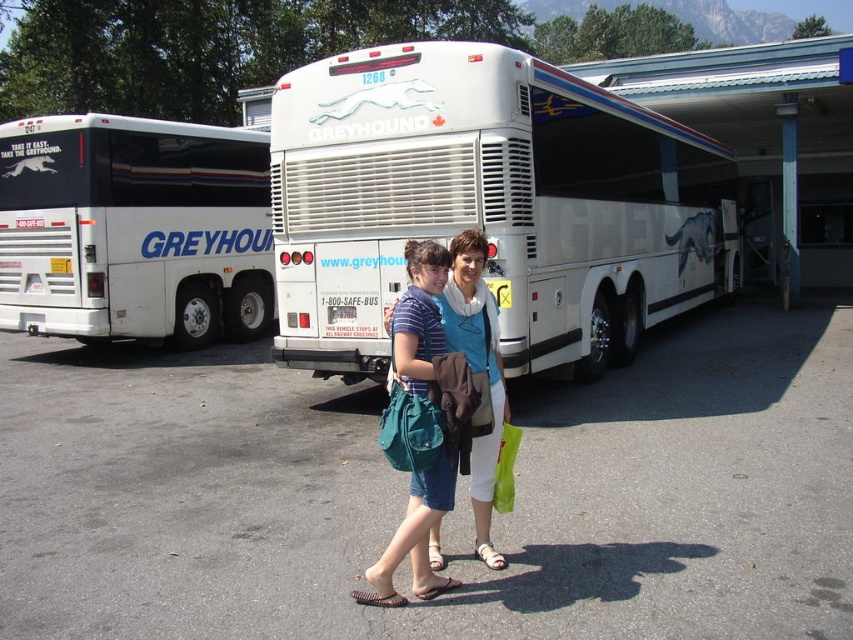
Which is in front, point (76, 200) or point (480, 403)?

Point (480, 403) is in front.

Is point (160, 170) more distant than point (469, 465)?

Yes, it is behind point (469, 465).

Who is more distant from viewer, (x=61, y=228) or (x=437, y=275)?

Positioned behind is point (x=61, y=228).

At what (x,y) coordinates should I click in order to perform the action: click on white matte/greyhound bus at left. Please return your answer as a coordinate pair (x, y). Looking at the image, I should click on (134, 228).

Does white matte bus at center have a smaller size compared to white matte/greyhound bus at left?

Incorrect, white matte bus at center is not smaller in size than white matte/greyhound bus at left.

Who is lower down, white matte bus at center or white matte/greyhound bus at left?

white matte bus at center is below.

Is point (561, 163) farther from camera compared to point (103, 227)?

No, it is in front of (103, 227).

Identify the location of white matte bus at center. point(488,204).

Is point (502, 49) positioned after point (399, 598)?

Yes, it is behind point (399, 598).

Is white matte bus at center to the right of teal fabric bag at center from the viewer's perspective?

Yes, white matte bus at center is to the right of teal fabric bag at center.

Image resolution: width=853 pixels, height=640 pixels. What do you see at coordinates (488, 204) in the screenshot?
I see `white matte bus at center` at bounding box center [488, 204].

Locate an element on the screen. The width and height of the screenshot is (853, 640). white matte bus at center is located at coordinates (x=488, y=204).